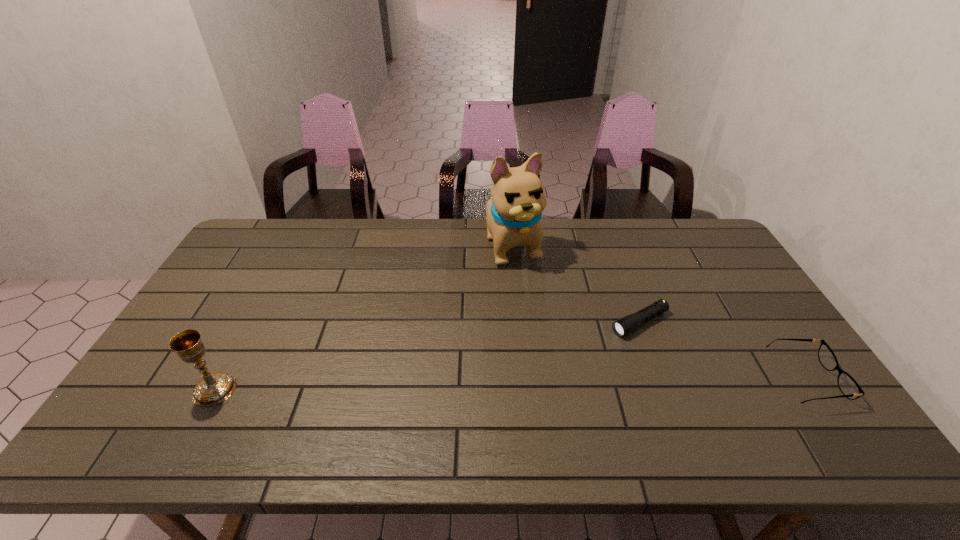
The height and width of the screenshot is (540, 960). Find the location of `the second tallest object`. the second tallest object is located at coordinates coord(213,389).

The height and width of the screenshot is (540, 960). I want to click on chalice, so click(x=213, y=389).

Identify the location of the rightmost object. point(849,387).

Locate an element on the screen. the second shortest object is located at coordinates (849, 387).

The height and width of the screenshot is (540, 960). Find the location of `flashlight`. flashlight is located at coordinates (625, 325).

Locate an element on the screen. the third object from left to right is located at coordinates (625, 325).

Locate an element on the screen. The width and height of the screenshot is (960, 540). the farthest object is located at coordinates (513, 213).

In order to click on puppy in this screenshot , I will do `click(513, 213)`.

Where is `free point located on the left of the chalice`? free point located on the left of the chalice is located at coordinates (167, 389).

At what (x,y) coordinates should I click in order to perform the action: click on vacant space located at the lens end of the second object from right to left. Please return your answer as a coordinate pair (x, y). Looking at the image, I should click on tap(531, 377).